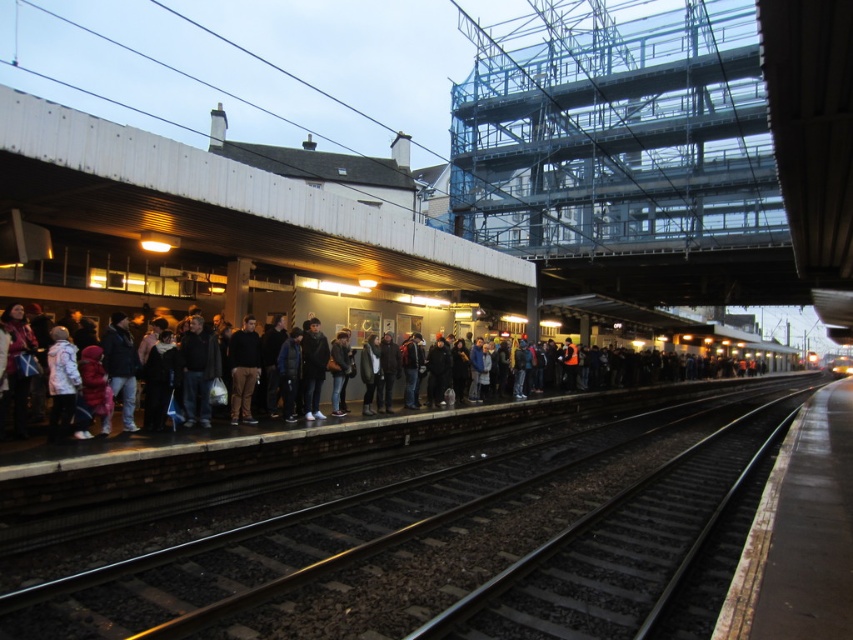
You are a photographer standing at the train station platform. You want to take a photo of the black metal track at center. If your camera can focus on objects up to 5 meters away, will you need to adjust your position to get a clear shot?

The black metal track at center is 5.40 meters away from the camera. Since the camera can focus up to 5 meters, you need to move closer to ensure the track is within the focus range.

You are a maintenance worker on the platform and need to access the black metal track at center for repairs. Since the yellow metallic train at center is currently occupying part of the platform, will you be able to access the track easily?

The black metal track at center occupies less space than the yellow metallic train at center, so the train is taking up more space on the platform. This means there might be limited access to the track, making it difficult to access easily.

In the scene shown: You are a passenger waiting for the train at the train station platform. You see a dark gray jacket at left and a yellow metallic train at center. Which object is closer to the platform edge?

The dark gray jacket at left is closer to the platform edge because it is positioned on the left side of the yellow metallic train at center, which is further away from the edge.